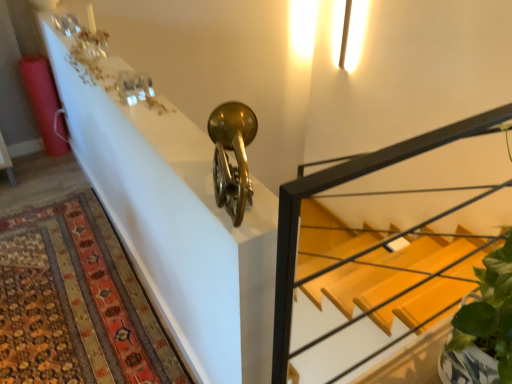
Identify the location of free space above wooden stairs at center (from a real-world perspective). This screenshot has height=384, width=512. (424, 142).